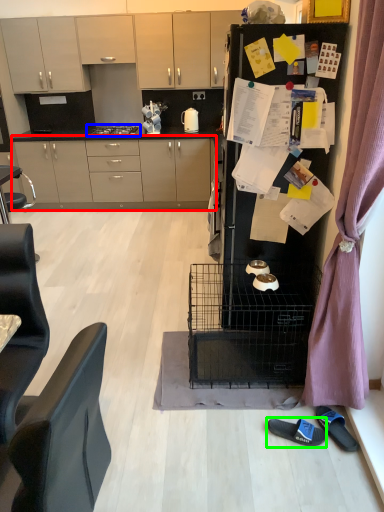
Question: Considering the real-world distances, which object is closest to cabinetry (highlighted by a red box)? home appliance (highlighted by a blue box) or footwear (highlighted by a green box).

Choices:
 (A) home appliance
 (B) footwear

Answer: (A)